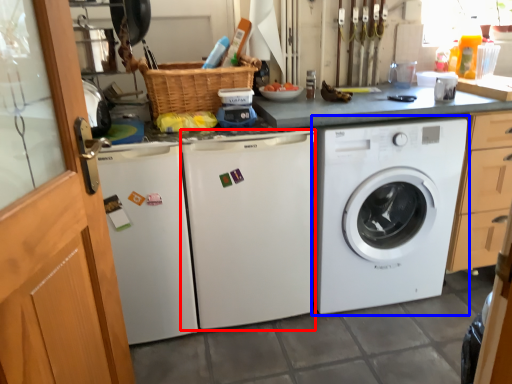
Question: Which object appears closest to the camera in this image, washing machine (highlighted by a red box) or washing machine (highlighted by a blue box)?

Choices:
 (A) washing machine
 (B) washing machine

Answer: (A)